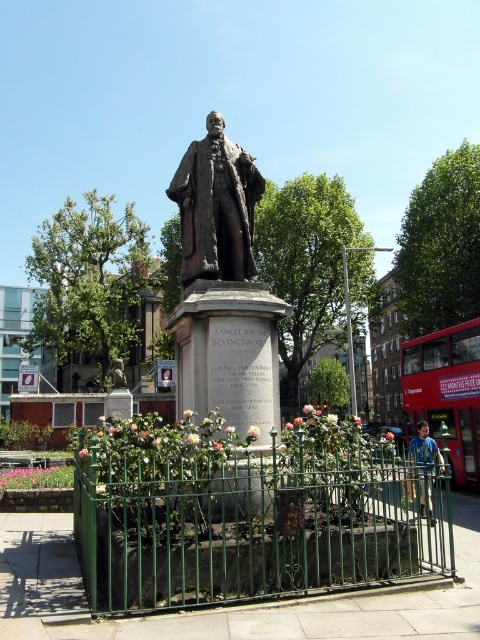
What is the relationship between the width of the bronze statue at center and the blue cotton shirt at lower right in the image?

The bronze statue at center is narrower than the blue cotton shirt at lower right.